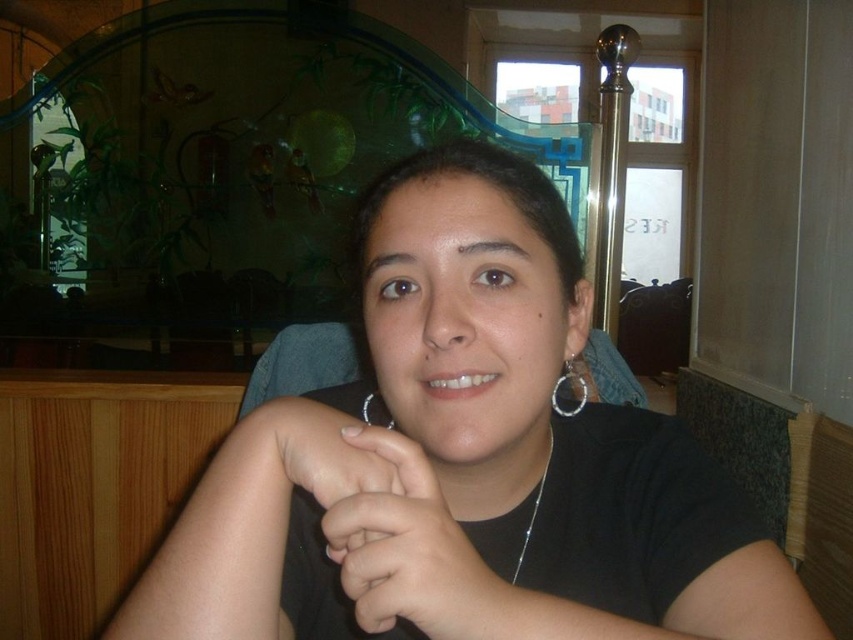
Question: Among these objects, which one is nearest to the camera?

Choices:
 (A) black matte hand at center
 (B) silver metallic necklace at center
 (C) silver metallic hoop at center

Answer: (A)

Question: Can you confirm if black matte hand at center is bigger than silver metallic hoop at center?

Choices:
 (A) no
 (B) yes

Answer: (A)

Question: Is silver metallic hoop at center above silver metallic necklace at center?

Choices:
 (A) no
 (B) yes

Answer: (B)

Question: Among these objects, which one is nearest to the camera?

Choices:
 (A) black matte shirt at center
 (B) silver metallic hoop at center
 (C) black matte hand at center

Answer: (A)

Question: Where is black matte hand at center located in relation to silver metallic necklace at center in the image?

Choices:
 (A) above
 (B) below

Answer: (B)

Question: Which point is closer to the camera?

Choices:
 (A) silver metallic hoop at center
 (B) black matte shirt at center

Answer: (B)